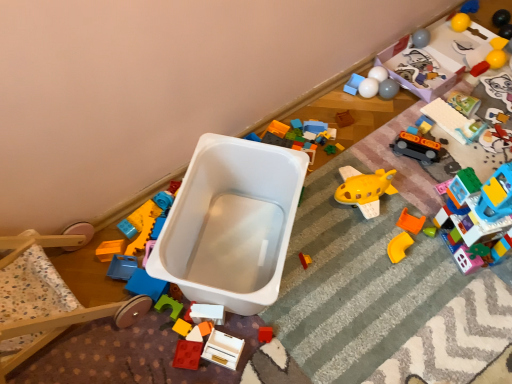
The width and height of the screenshot is (512, 384). I want to click on vacant area that is in front of white glossy balls at upper right, placed as the eighth toy when sorted from right to left, so click(377, 125).